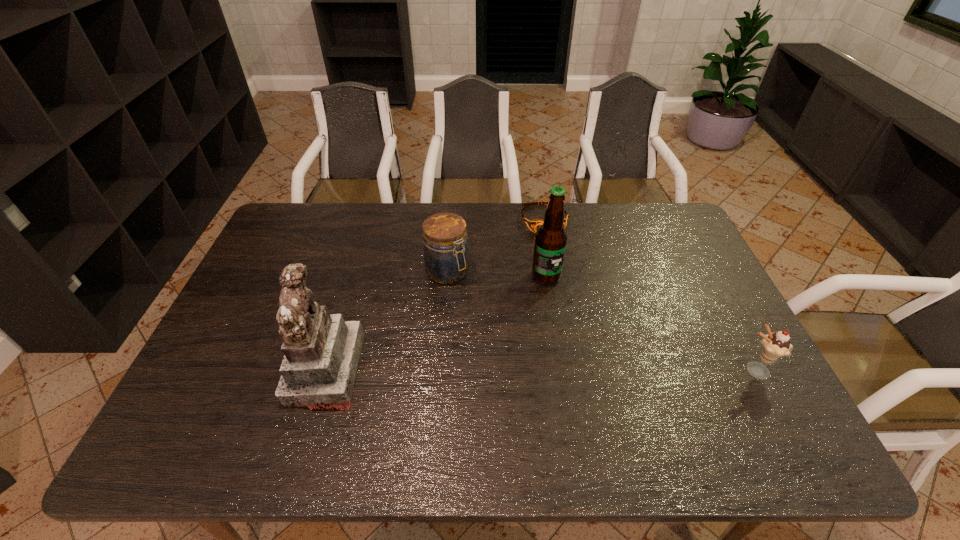
This screenshot has width=960, height=540. I want to click on object that stands as the third closest to the rightmost object, so click(x=446, y=257).

Locate an element on the screen. This screenshot has height=540, width=960. object that can be found as the fourth closest to the figurine is located at coordinates (774, 346).

You are a GUI agent. You are given a task and a screenshot of the screen. Output one action in this format:
    pyautogui.click(x=<x>, y=<y>)
    Task: Click on the vacant space that satisfies the following two spatial constraints: 1. on the back side of the jar; 2. on the right side of the goggles
    The image size is (960, 540).
    Given the screenshot: What is the action you would take?
    pyautogui.click(x=451, y=219)

This screenshot has height=540, width=960. In order to click on vacant space that satisfies the following two spatial constraints: 1. on the back side of the goggles; 2. on the left side of the jar in this screenshot , I will do [451, 219].

Where is `free point that satisfies the following two spatial constraints: 1. on the back side of the jar; 2. on the right side of the farthest object`? This screenshot has height=540, width=960. free point that satisfies the following two spatial constraints: 1. on the back side of the jar; 2. on the right side of the farthest object is located at coordinates (451, 219).